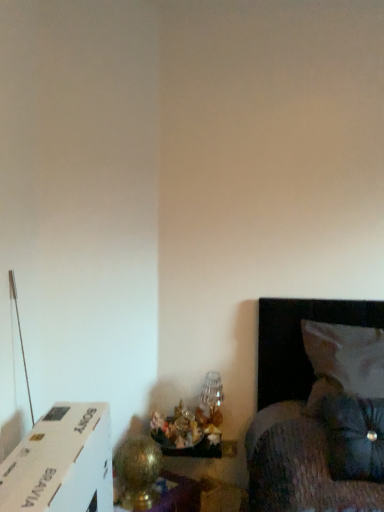
Where is `free space above gold metallic table lamp at lower left, the 1th table lamp viewed from the left (from a real-world perspective)`? This screenshot has height=512, width=384. free space above gold metallic table lamp at lower left, the 1th table lamp viewed from the left (from a real-world perspective) is located at coordinates (130, 435).